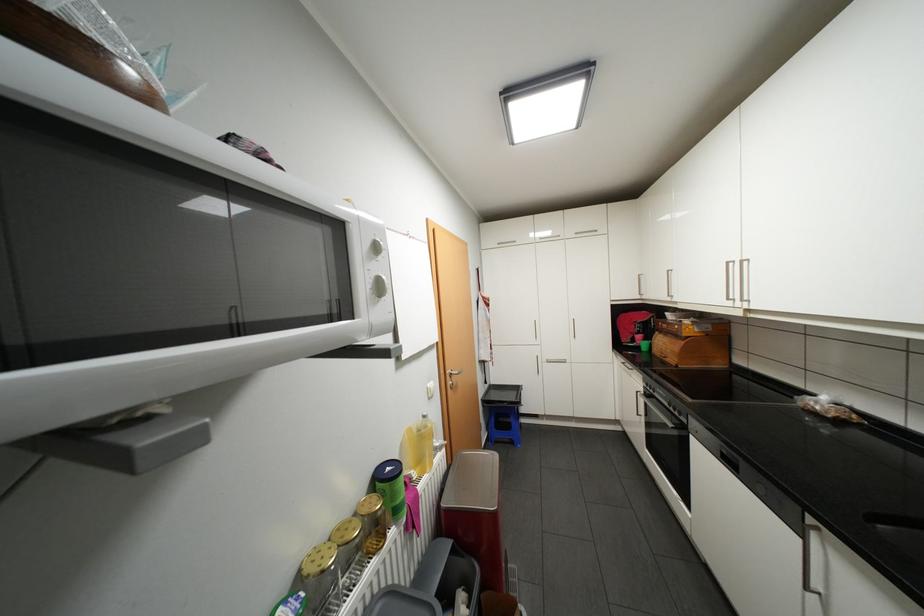
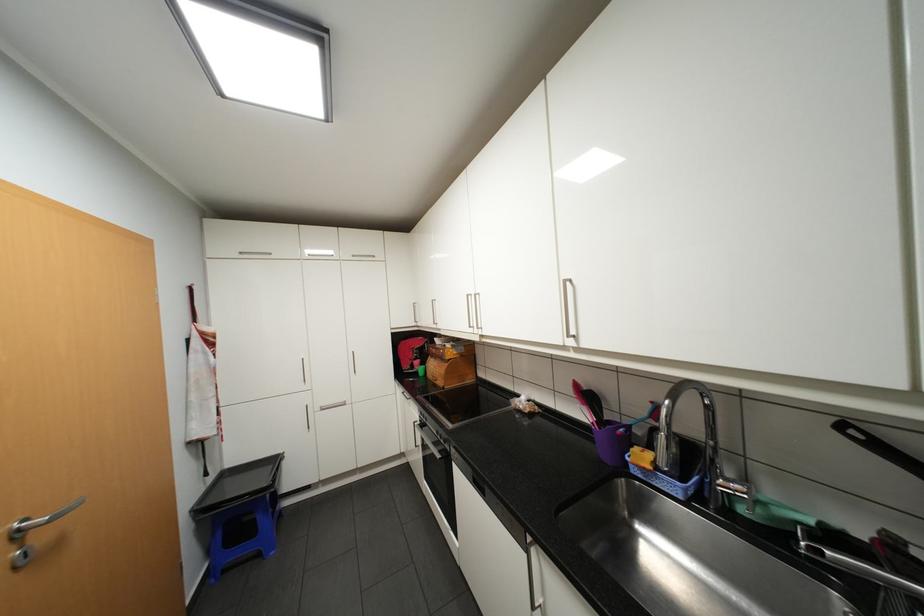
Locate, in the second image, the point that corresponds to (x=494, y=385) in the first image.

(220, 476)